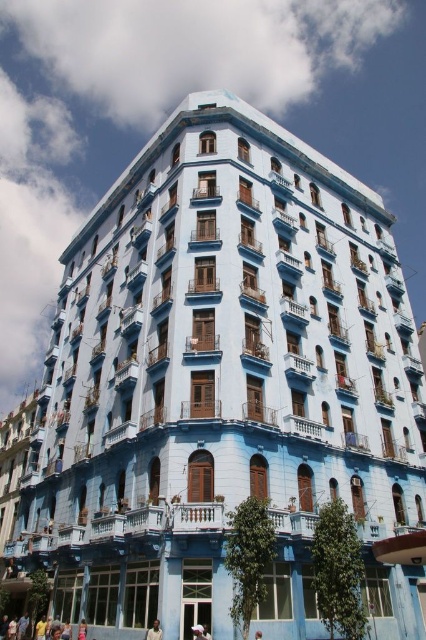
Question: Which point is farther from the camera taking this photo?

Choices:
 (A) (155, 632)
 (B) (81, 624)
 (C) (256, 632)
 (D) (203, 636)

Answer: (B)

Question: Does skinny jeans at lower center appear on the right side of reddish-brown leather cap at center?

Choices:
 (A) yes
 (B) no

Answer: (B)

Question: Considering the real-world distances, which object is closest to the white fabric at center?

Choices:
 (A) skinny jeans at lower center
 (B) dark skin smooth face at center

Answer: (B)

Question: Which of the following is the farthest from the observer?

Choices:
 (A) (146, 632)
 (B) (86, 627)
 (C) (259, 630)
 (D) (196, 625)

Answer: (B)

Question: Is white fabric at center below reddish-brown leather cap at center?

Choices:
 (A) no
 (B) yes

Answer: (A)

Question: Observing the image, what is the correct spatial positioning of dark skin smooth face at center in reference to white fabric at center?

Choices:
 (A) right
 (B) left

Answer: (B)